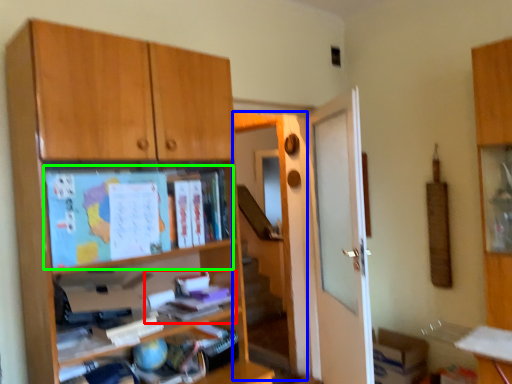
Question: Considering the real-world distances, which object is farthest from book (highlighted by a red box)? screen door (highlighted by a blue box) or paperback book (highlighted by a green box)?

Choices:
 (A) screen door
 (B) paperback book

Answer: (A)